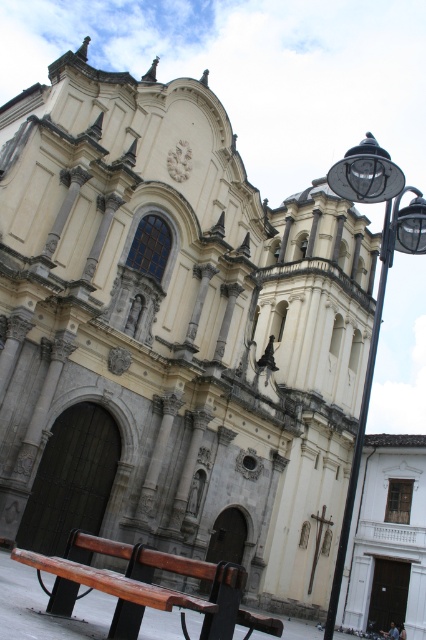
Does wooden bench at lower left appear under black metal streetlight at right?

Yes, wooden bench at lower left is below black metal streetlight at right.

Can you confirm if wooden bench at lower left is shorter than black metal streetlight at right?

Indeed, wooden bench at lower left has a lesser height compared to black metal streetlight at right.

You are a GUI agent. You are given a task and a screenshot of the screen. Output one action in this format:
    pyautogui.click(x=<x>, y=<y>)
    Task: Click on the wooden bench at lower left
    This screenshot has height=640, width=426.
    Given the screenshot: What is the action you would take?
    pyautogui.click(x=146, y=586)